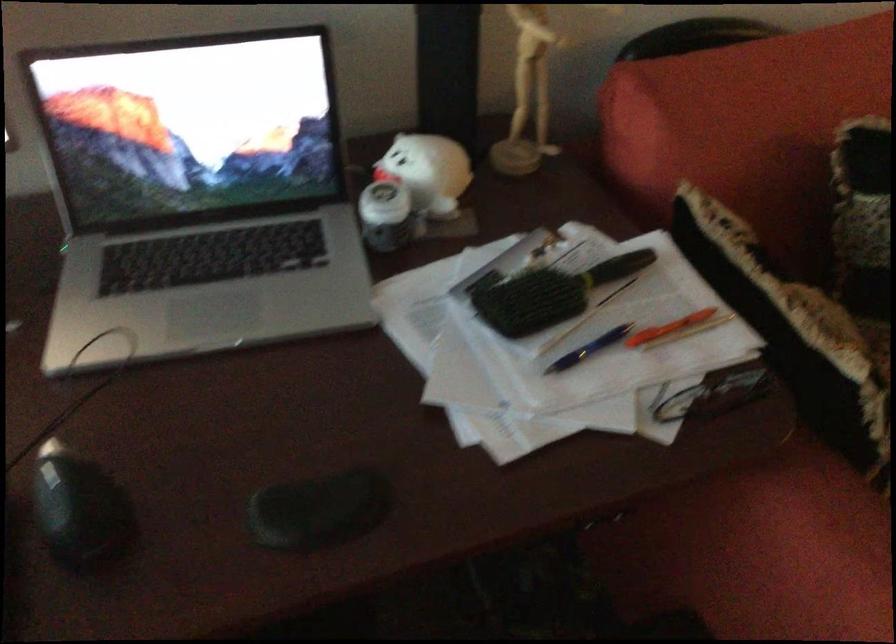
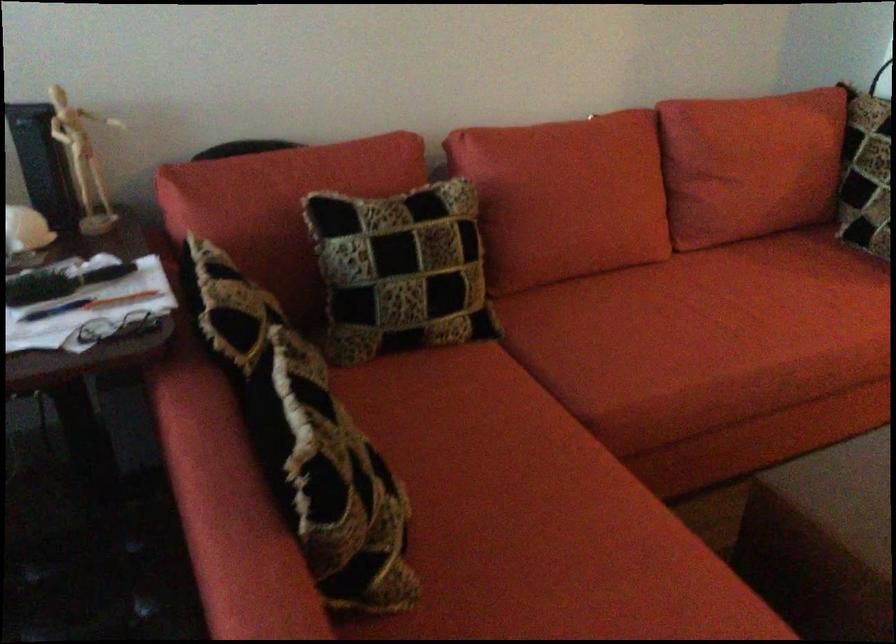
The images are taken continuously from a first-person perspective. In which direction are you moving?

The cameraman moved toward right, backward.